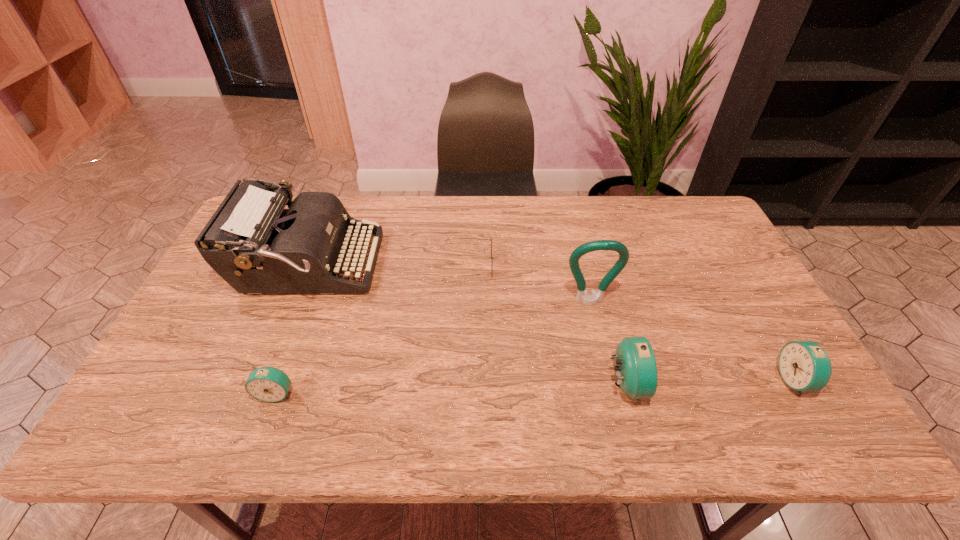
The image size is (960, 540). What are the coordinates of `vacant region between the tallest alarm clock and the rightmost alarm clock` in the screenshot? It's located at (710, 382).

Locate an element on the screen. The height and width of the screenshot is (540, 960). empty space that is in between the fourth tallest object and the fourth shortest object is located at coordinates (710, 382).

Identify the location of vacant space in between the fourth shortest object and the rightmost object. (710, 382).

I want to click on free space between the tallest alarm clock and the leftmost alarm clock, so click(450, 389).

You are a GUI agent. You are given a task and a screenshot of the screen. Output one action in this format:
    pyautogui.click(x=<x>, y=<y>)
    Task: Click on the free space that is in between the leftmost alarm clock and the shortest object
    The height and width of the screenshot is (540, 960).
    Given the screenshot: What is the action you would take?
    pyautogui.click(x=372, y=329)

You are a GUI agent. You are given a task and a screenshot of the screen. Output one action in this format:
    pyautogui.click(x=<x>, y=<y>)
    Task: Click on the vacant space that is in between the leftmost alarm clock and the rightmost alarm clock
    Image resolution: width=960 pixels, height=540 pixels.
    Given the screenshot: What is the action you would take?
    pyautogui.click(x=536, y=387)

Where is `empty space between the bottle opener and the second tallest alarm clock`? The width and height of the screenshot is (960, 540). empty space between the bottle opener and the second tallest alarm clock is located at coordinates (692, 341).

Locate an element on the screen. The width and height of the screenshot is (960, 540). free space between the typewriter and the bottle opener is located at coordinates (448, 284).

Locate an element on the screen. The width and height of the screenshot is (960, 540). object that is the closest to the rightmost object is located at coordinates (636, 370).

Locate an element on the screen. Image resolution: width=960 pixels, height=540 pixels. object that can be found as the second closest to the fourth object from right to left is located at coordinates (252, 242).